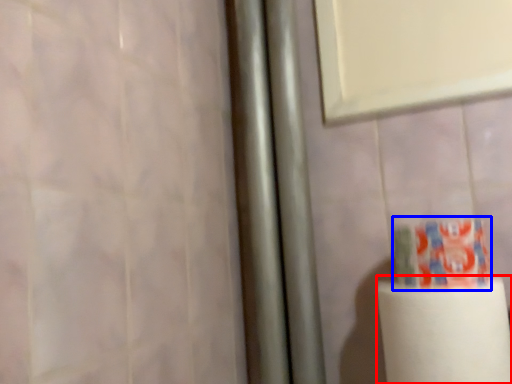
Question: Which of the following is the closest to the observer, paper towel (highlighted by a red box) or toothpaste (highlighted by a blue box)?

Choices:
 (A) paper towel
 (B) toothpaste

Answer: (A)